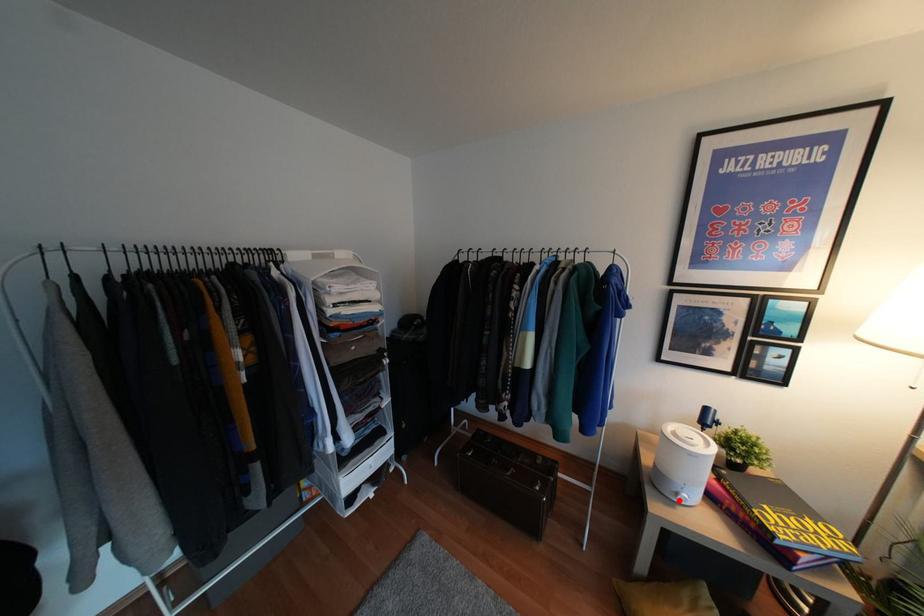
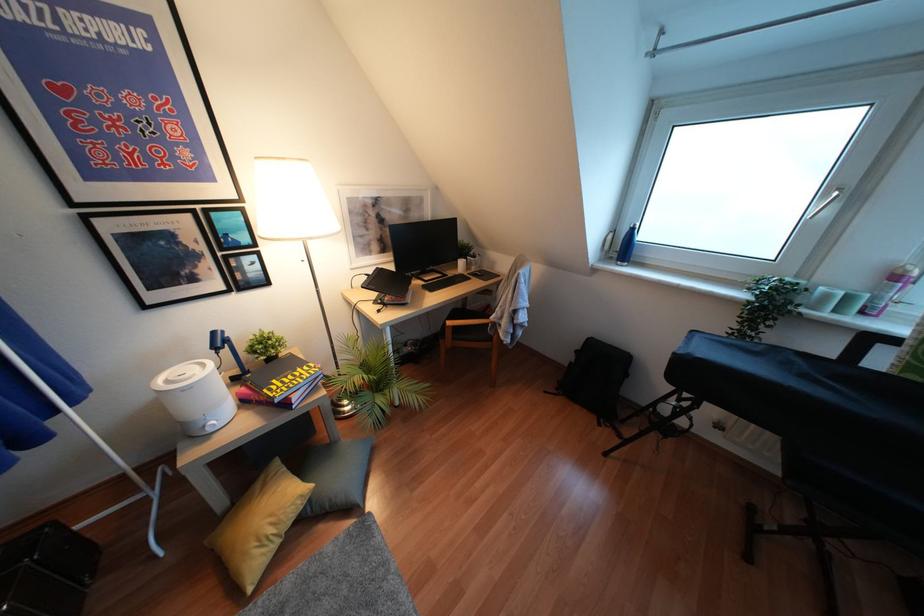
Question: A red point is marked in image1. In image2, is the corresponding 3D point closer to the camera or farther? Reply with the corresponding letter.

Choices:
 (A) The corresponding 3D point is closer.
 (B) The corresponding 3D point is farther.

Answer: (A)